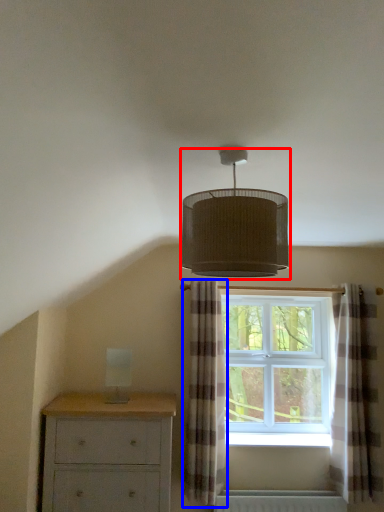
Question: Among these objects, which one is nearest to the camera, lamp (highlighted by a red box) or curtain (highlighted by a blue box)?

Choices:
 (A) lamp
 (B) curtain

Answer: (A)